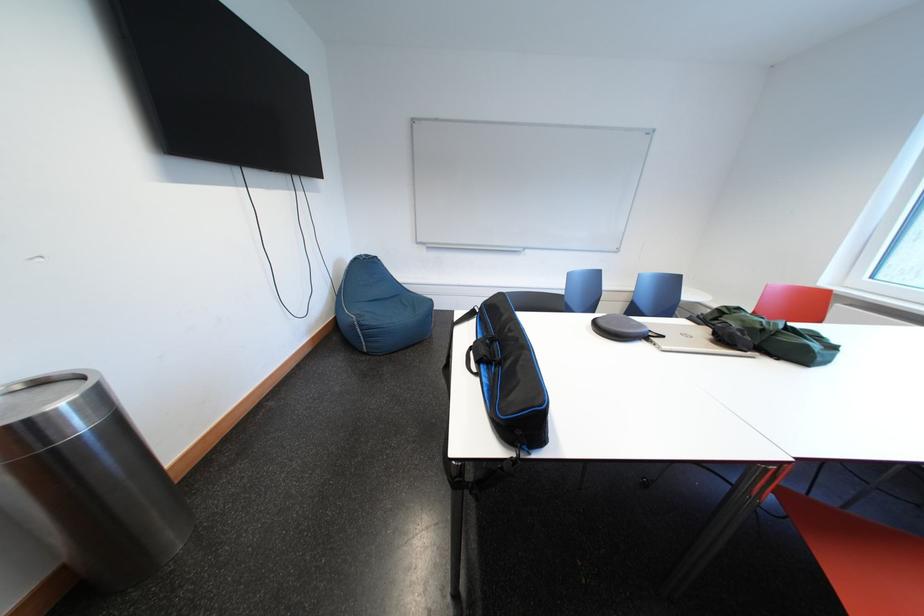
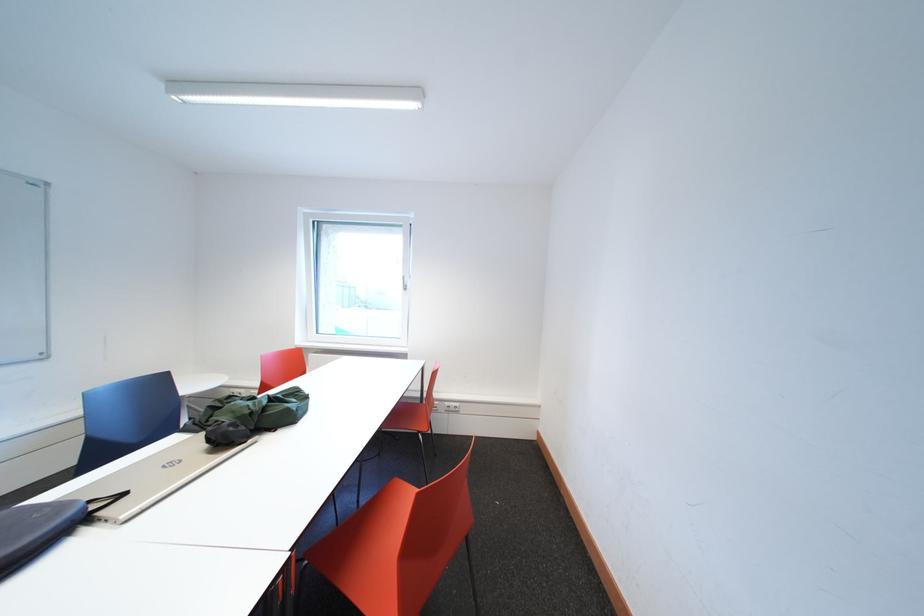
Question: How did the camera likely rotate?

Choices:
 (A) Left
 (B) Right
 (C) Up
 (D) Down

Answer: (B)